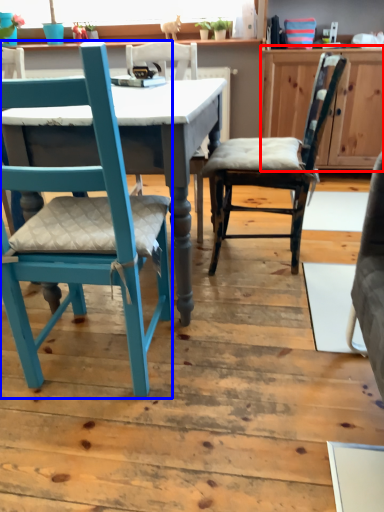
Question: Which object is closer to the camera taking this photo, cabinetry (highlighted by a red box) or chair (highlighted by a blue box)?

Choices:
 (A) cabinetry
 (B) chair

Answer: (B)